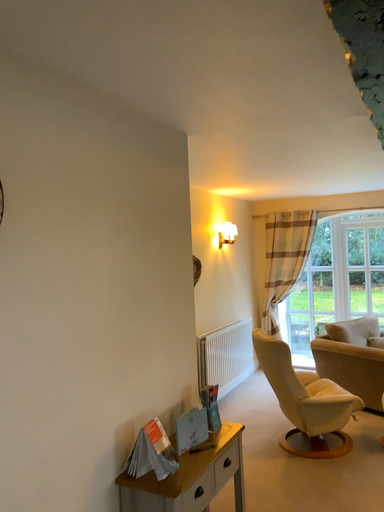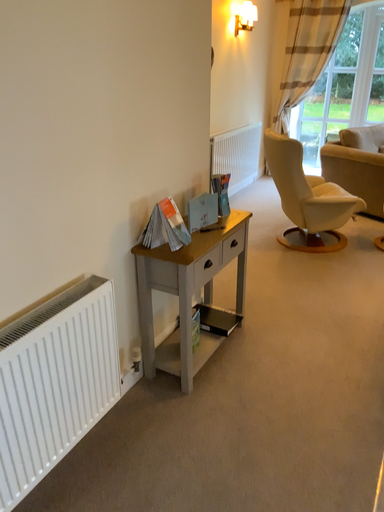
Question: How did the camera likely rotate when shooting the video?

Choices:
 (A) rotated upward
 (B) rotated downward

Answer: (B)